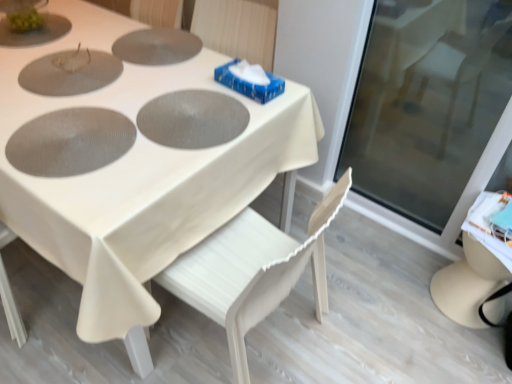
Question: Visually, is matte gray pizza pan at center, which appears as the third pizza pan when viewed from the back, positioned to the left or to the right of white wood chair at center?

Choices:
 (A) left
 (B) right

Answer: (A)

Question: Is matte gray pizza pan at center, which appears as the third pizza pan when viewed from the back, situated inside white wood chair at center or outside?

Choices:
 (A) inside
 (B) outside

Answer: (B)

Question: Which object is positioned farthest from the white wood chair at center?

Choices:
 (A) matte gray pizza pan at upper center, which is the 3th pizza pan from front to back
 (B) gray matte pizza pan at center, which is the second pizza pan from front to back
 (C) white matte table at center
 (D) matte gray pizza pan at center, which is counted as the 1th pizza pan, starting from the front
 (E) transparent glass door at right

Answer: (E)

Question: Which of these objects is positioned farthest from the white wood chair at center?

Choices:
 (A) matte gray pizza pan at center, which is counted as the 1th pizza pan, starting from the front
 (B) white matte table at center
 (C) matte gray pizza pan at upper center, which is the 3th pizza pan from front to back
 (D) gray matte pizza pan at center, which is the second pizza pan from front to back
 (E) transparent glass door at right

Answer: (E)